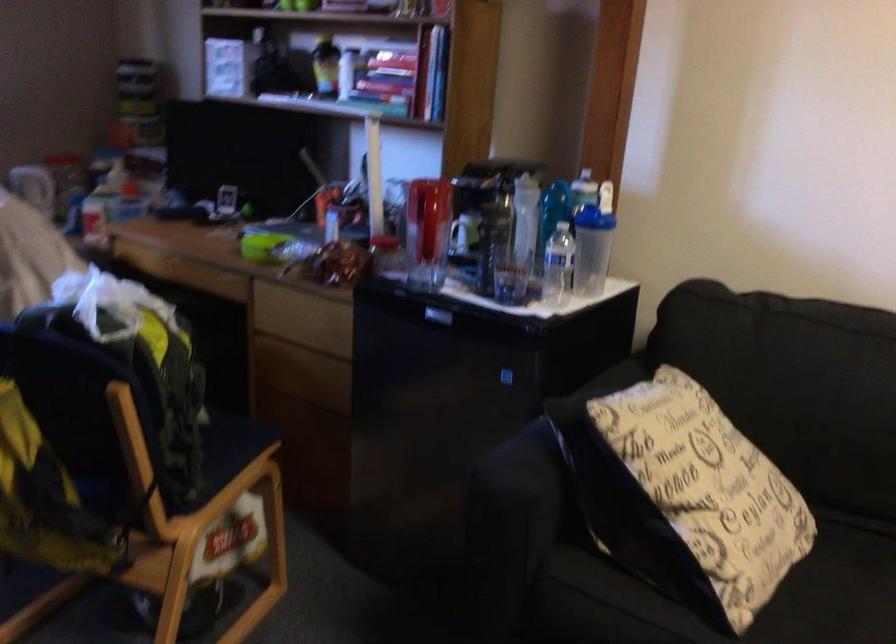
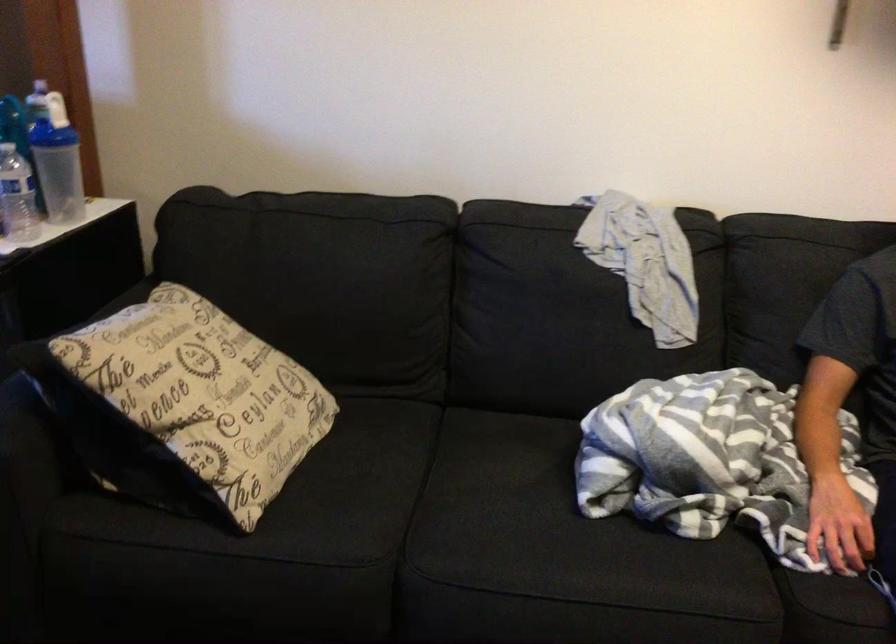
Where in the second image is the point corresponding to point (561, 270) from the first image?

(16, 196)